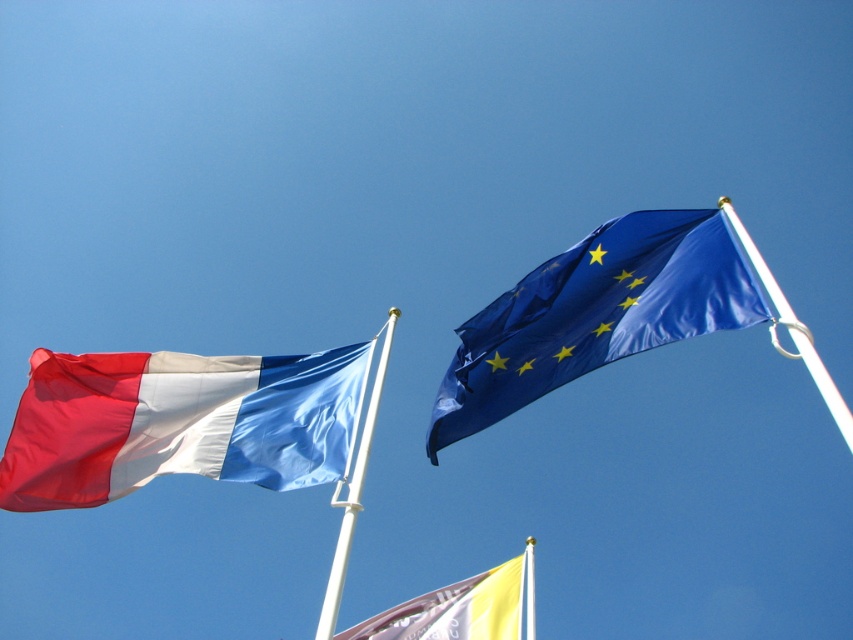
Who is lower down, matte fabric flag at left or white plastic flag pole at lower center?

white plastic flag pole at lower center is below.

Which of these two, matte fabric flag at left or white plastic flag pole at lower center, stands shorter?

With less height is matte fabric flag at left.

This screenshot has width=853, height=640. I want to click on matte fabric flag at left, so click(x=177, y=422).

Is blue glossy flag at upper right smaller than white plastic flag pole at upper right?

Correct, blue glossy flag at upper right occupies less space than white plastic flag pole at upper right.

Does blue glossy flag at upper right have a lesser width compared to white plastic flag pole at upper right?

Yes.

This screenshot has width=853, height=640. What do you see at coordinates (595, 314) in the screenshot?
I see `blue glossy flag at upper right` at bounding box center [595, 314].

This screenshot has height=640, width=853. In order to click on blue glossy flag at upper right in this screenshot , I will do `click(595, 314)`.

Can you confirm if blue glossy flag at upper right is shorter than yellow fabric flag at lower center?

Result: Yes.

Is point (598, 339) positioned before point (450, 602)?

That is True.

The height and width of the screenshot is (640, 853). Identify the location of blue glossy flag at upper right. (595, 314).